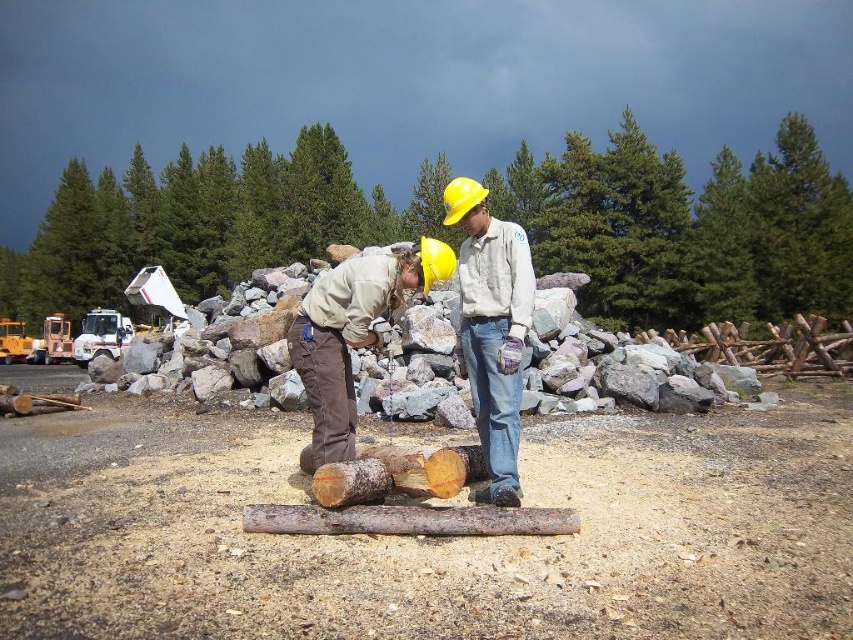
Question: Can you confirm if brown rough wood at center is bigger than rusty wood log at center?

Choices:
 (A) yes
 (B) no

Answer: (A)

Question: Based on their relative distances, which object is nearer to the matte yellow hard hat at center?

Choices:
 (A) brown rough wood at center
 (B) wooden log at center
 (C) matte khaki shirt at center
 (D) rusty wood log at center

Answer: (B)

Question: Can you confirm if brown rough wood at center is positioned below rusty wood log at center?

Choices:
 (A) no
 (B) yes

Answer: (B)

Question: Which point is farther to the camera?

Choices:
 (A) wooden log at center
 (B) rusty wood log at center
 (C) matte yellow hard hat at center
 (D) matte khaki shirt at center

Answer: (D)

Question: Considering the real-world distances, which object is farthest from the matte khaki shirt at center?

Choices:
 (A) wooden log at center
 (B) rusty wood log at center
 (C) matte yellow hard hat at center
 (D) brown rough wood at center

Answer: (D)

Question: Is matte yellow hard hat at center to the right of wooden log at center from the viewer's perspective?

Choices:
 (A) yes
 (B) no

Answer: (A)